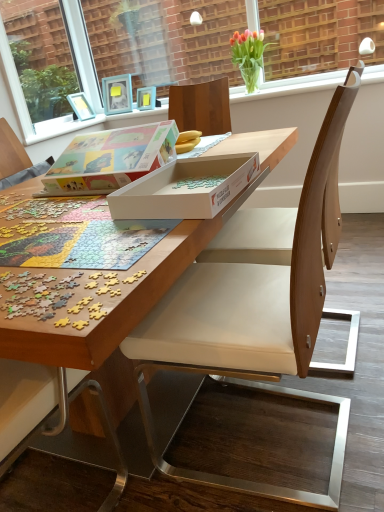
Question: Is translucent glass vase at upper center in front of or behind wooden puzzle at center in the image?

Choices:
 (A) front
 (B) behind

Answer: (B)

Question: From a real-world perspective, relative to wooden puzzle at center, is translucent glass vase at upper center vertically above or below?

Choices:
 (A) above
 (B) below

Answer: (A)

Question: Which of these objects is positioned farthest from the matte cardboard box at center, acting as the 2th box starting from the front?

Choices:
 (A) white cardboard box at center, marked as the second box in a back-to-front arrangement
 (B) light blue wooden picture frame at upper center
 (C) clear glass vase at upper center, which is the second window screen in left-to-right order
 (D) clear glass window screen at upper left, marked as the 2th window screen in a right-to-left arrangement
 (E) light brown wood chair at center

Answer: (D)

Question: Which is nearer to the multicolored plastic jigsaw puzzle pieces at lower left?

Choices:
 (A) light blue wooden picture frame at upper center
 (B) white cardboard box at center, marked as the second box in a back-to-front arrangement
 (C) wooden puzzle at center
 (D) translucent glass vase at upper center
 (E) clear glass vase at upper center, the first window screen viewed from the right

Answer: (C)